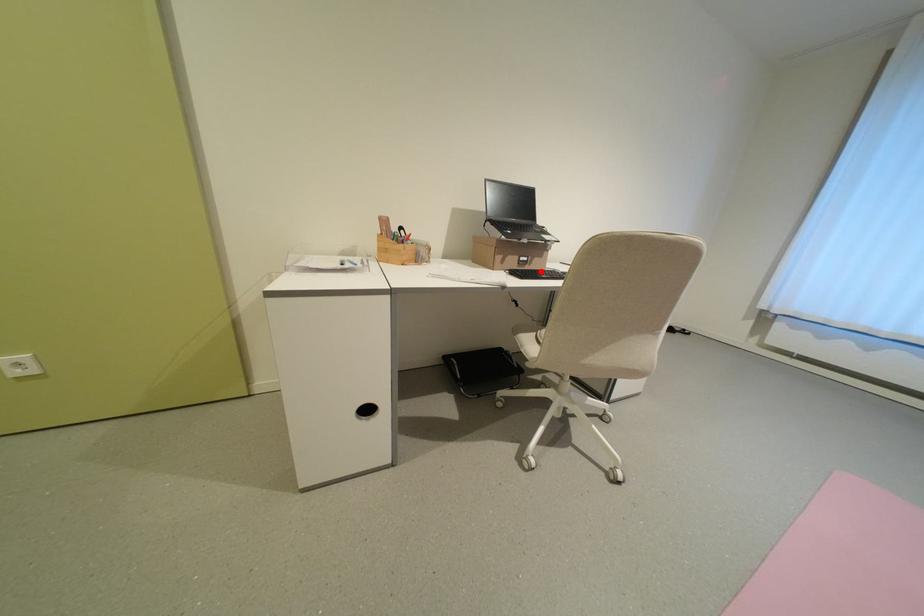
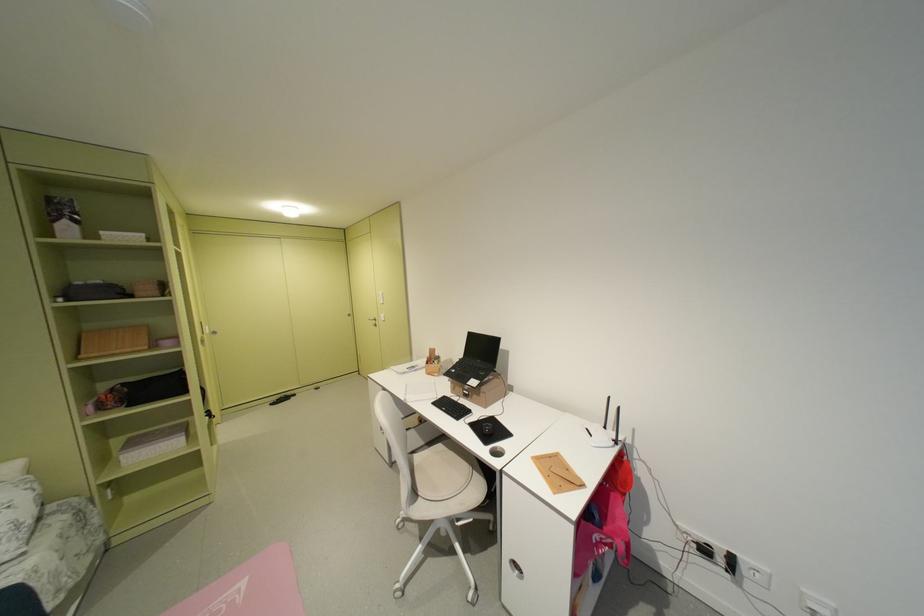
Question: I am providing you with two images of the same scene from different viewpoints. In image1, a red point is highlighted. Considering the same 3D point in image2, which of the following is correct?

Choices:
 (A) It is closer
 (B) It is farther

Answer: (B)